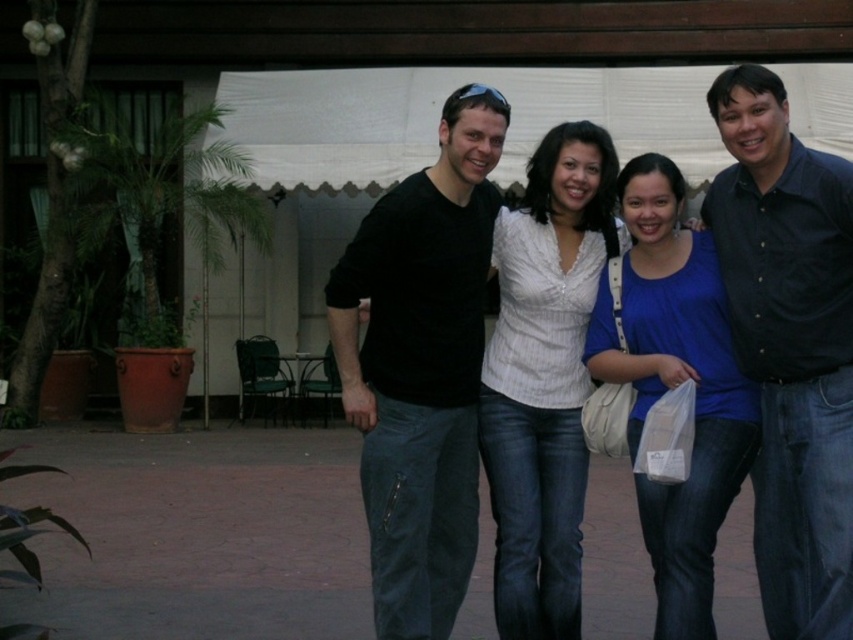
Question: Is black matte shirt at center further to the viewer compared to matte black shirt at center?

Choices:
 (A) yes
 (B) no

Answer: (A)

Question: Does matte black shirt at center appear under blue cotton shirt at center?

Choices:
 (A) no
 (B) yes

Answer: (A)

Question: Can you confirm if black matte shirt at center is positioned to the right of white textured blouse at center?

Choices:
 (A) yes
 (B) no

Answer: (B)

Question: Which of the following is the closest to the observer?

Choices:
 (A) white textured blouse at center
 (B) black shirt at center
 (C) blue cotton shirt at center
 (D) matte black shirt at center

Answer: (B)

Question: Which of the following is the closest to the observer?

Choices:
 (A) blue cotton shirt at center
 (B) black shirt at center
 (C) white textured blouse at center
 (D) black matte shirt at center

Answer: (B)

Question: Considering the real-world distances, which object is closest to the black matte shirt at center?

Choices:
 (A) white textured blouse at center
 (B) matte black shirt at center
 (C) black shirt at center

Answer: (A)